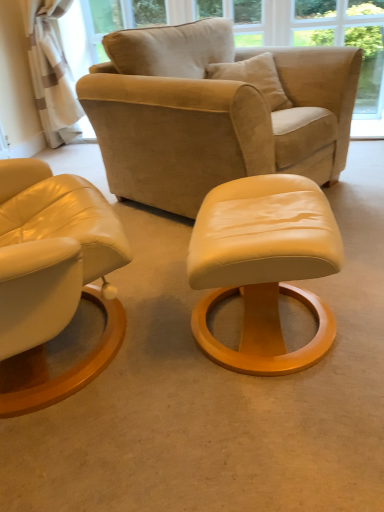
The width and height of the screenshot is (384, 512). What are the coordinates of `vacant space positioned to the left of matte cream leather ottoman at center` in the screenshot? It's located at (139, 343).